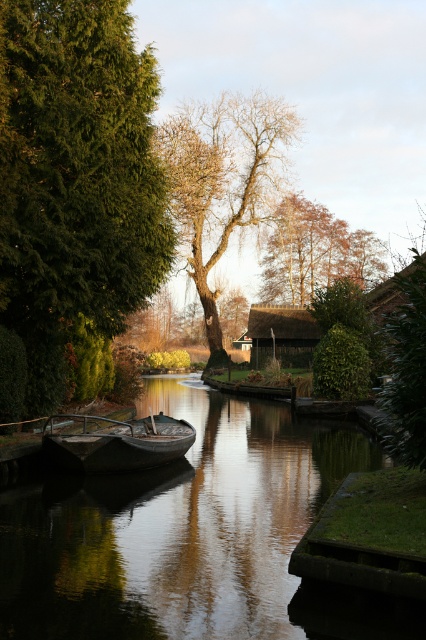
Question: Which object is the closest to the wooden boat at center?

Choices:
 (A) bare wood tree at center
 (B) green textured tree at left

Answer: (B)

Question: Does green textured tree at left have a lesser width compared to brown wood tree at upper center?

Choices:
 (A) no
 (B) yes

Answer: (B)

Question: Can you confirm if green textured tree at left is positioned to the left of thatched wood hut at center?

Choices:
 (A) no
 (B) yes

Answer: (B)

Question: Is the position of smooth dark water at center less distant than that of bare wood tree at center?

Choices:
 (A) no
 (B) yes

Answer: (B)

Question: Which is nearer to the brown wood tree at upper center?

Choices:
 (A) smooth dark water at center
 (B) green textured tree at left
 (C) wooden boat at center
 (D) thatched wood hut at center

Answer: (D)

Question: Which point is closer to the camera?

Choices:
 (A) brown wood tree at upper center
 (B) bare wood tree at center

Answer: (B)